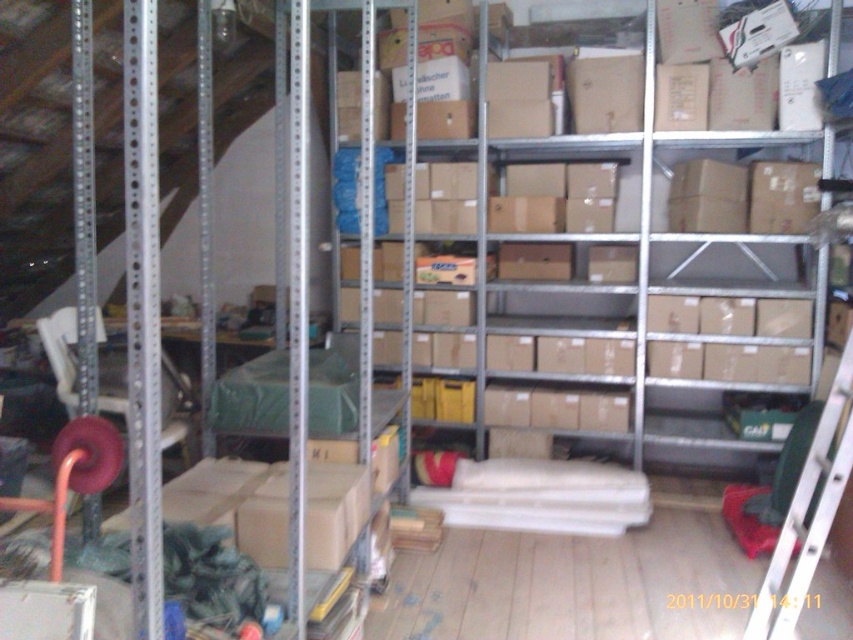
Is brown cardboard boxes at center in front of silver metallic ladder at lower right?

No, it is behind silver metallic ladder at lower right.

This screenshot has width=853, height=640. In order to click on brown cardboard boxes at center in this screenshot , I will do `click(602, 288)`.

Locate an element on the screen. brown cardboard boxes at center is located at coordinates (602, 288).